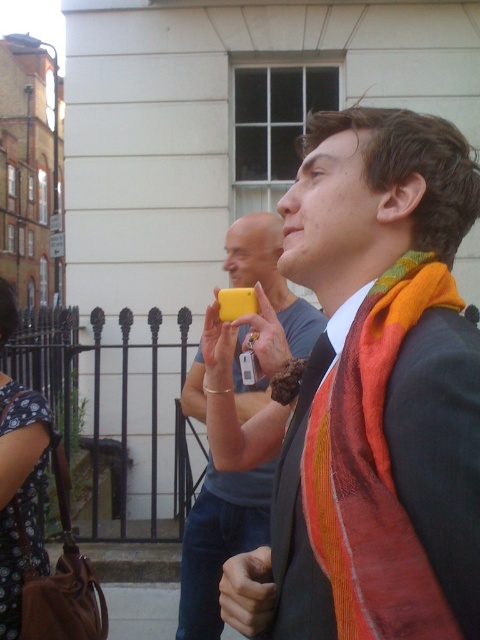
Question: Estimate the real-world distances between objects in this image. Which object is closer to the multicolored woven scarf at right?

Choices:
 (A) yellow matte phone at center
 (B) matte orange scarf at right
 (C) dark floral dress at lower left

Answer: (B)

Question: Estimate the real-world distances between objects in this image. Which object is farther from the matte orange scarf at right?

Choices:
 (A) dark floral dress at lower left
 (B) multicolored woven scarf at right

Answer: (A)

Question: Is matte orange scarf at right positioned at the back of dark floral dress at lower left?

Choices:
 (A) no
 (B) yes

Answer: (A)

Question: In this image, where is matte orange scarf at right located relative to multicolored woven scarf at right?

Choices:
 (A) left
 (B) right

Answer: (A)

Question: Which object is closer to the camera taking this photo?

Choices:
 (A) dark floral dress at lower left
 (B) yellow matte phone at center

Answer: (A)

Question: Is multicolored woven scarf at right to the right of yellow matte phone at center from the viewer's perspective?

Choices:
 (A) yes
 (B) no

Answer: (A)